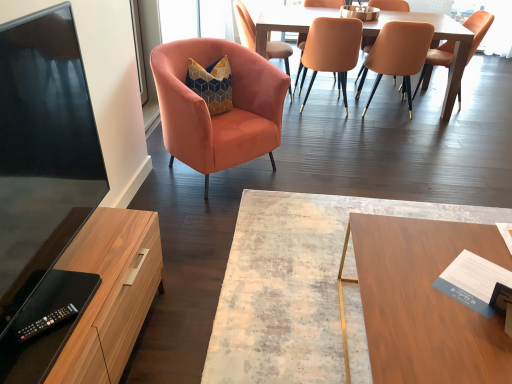
The height and width of the screenshot is (384, 512). Identify the location of vacant area on top of wooden cabinet at left (from a real-world perspective). (92, 259).